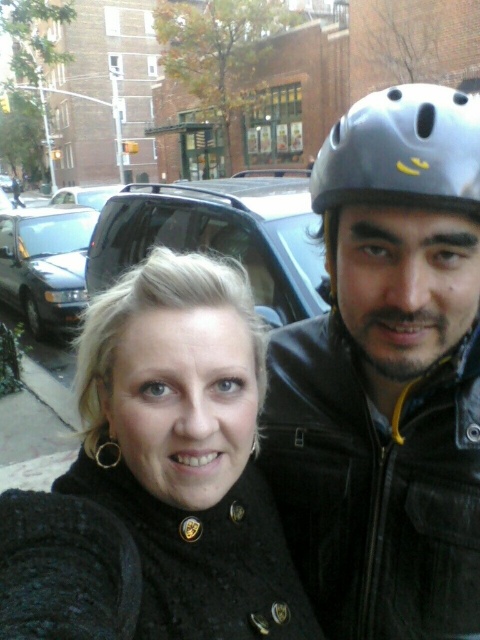
Question: Which point appears farthest from the camera in this image?

Choices:
 (A) (101, 193)
 (B) (469, 348)
 (C) (268, 257)
 (D) (477, 211)

Answer: (A)

Question: Which object appears farthest from the camera in this image?

Choices:
 (A) matte black car at center
 (B) matte black helmet at upper right

Answer: (A)

Question: Can you confirm if gray matte helmet at upper right is positioned above matte black car at center?

Choices:
 (A) yes
 (B) no

Answer: (B)

Question: Is black matte car at center below matte black car at center?

Choices:
 (A) yes
 (B) no

Answer: (A)

Question: Is matte black helmet at upper right above matte gray helmet at upper right?

Choices:
 (A) no
 (B) yes

Answer: (A)

Question: Which object appears closest to the camera in this image?

Choices:
 (A) matte black car at center
 (B) gray matte helmet at upper right

Answer: (B)